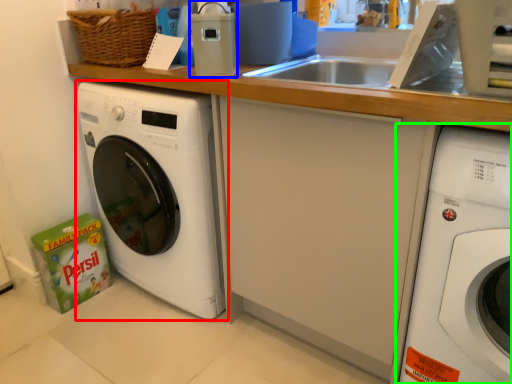
Question: Which is farther away from washing machine (highlighted by a red box)? appliance (highlighted by a blue box) or washing machine (highlighted by a green box)?

Choices:
 (A) appliance
 (B) washing machine

Answer: (B)